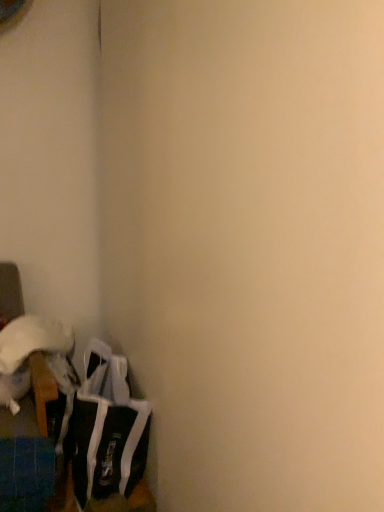
The width and height of the screenshot is (384, 512). In order to click on black fabric luggage at lower left in this screenshot , I will do `click(106, 430)`.

This screenshot has height=512, width=384. Describe the element at coordinates (106, 430) in the screenshot. I see `black fabric luggage at lower left` at that location.

The image size is (384, 512). I want to click on black fabric luggage at lower left, so click(106, 430).